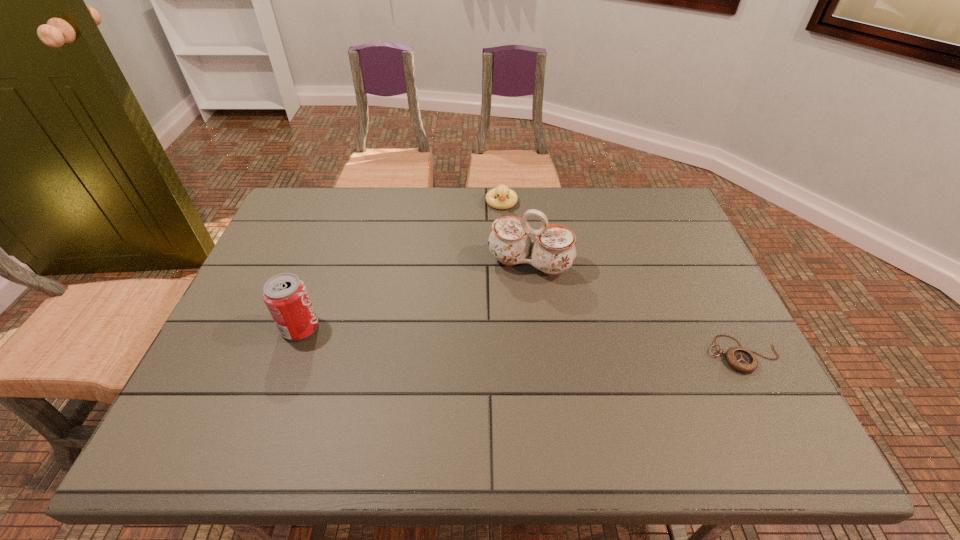
At what (x,y) coordinates should I click in order to perform the action: click on free space at the far edge of the desktop. Please return your answer as a coordinate pair (x, y). This screenshot has height=540, width=960. Looking at the image, I should click on (438, 226).

Image resolution: width=960 pixels, height=540 pixels. In the image, there is a desktop. What are the coordinates of `free space at the near edge` in the screenshot? It's located at (521, 388).

The height and width of the screenshot is (540, 960). I want to click on free space at the right edge of the desktop, so click(726, 320).

This screenshot has height=540, width=960. Find the location of `free location at the far left corner`. free location at the far left corner is located at coordinates (293, 208).

Identify the location of vacant area at the near left corner of the desktop. pyautogui.click(x=237, y=392).

Locate an element on the screen. free point at the near right corner is located at coordinates (732, 406).

The width and height of the screenshot is (960, 540). In order to click on vacant point located between the soda can and the chinaware in this screenshot , I will do `click(415, 296)`.

Identify the location of vacant area that lies between the shortest object and the third tallest object. (622, 279).

Find the location of a particular element. The height and width of the screenshot is (540, 960). blank region between the third shortest object and the duckling is located at coordinates (401, 265).

The height and width of the screenshot is (540, 960). Find the location of `vacant space that's between the third nearest object and the rightmost object`. vacant space that's between the third nearest object and the rightmost object is located at coordinates (636, 309).